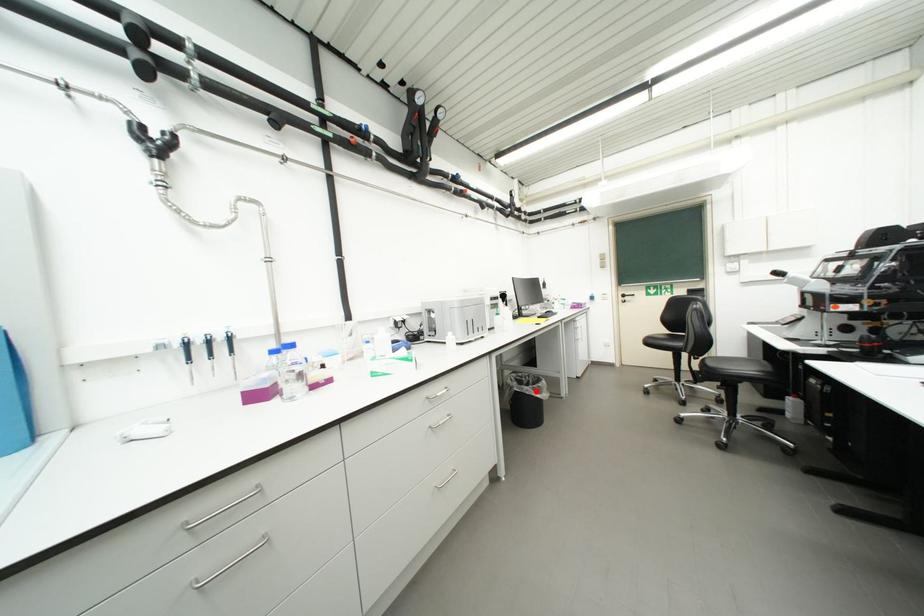
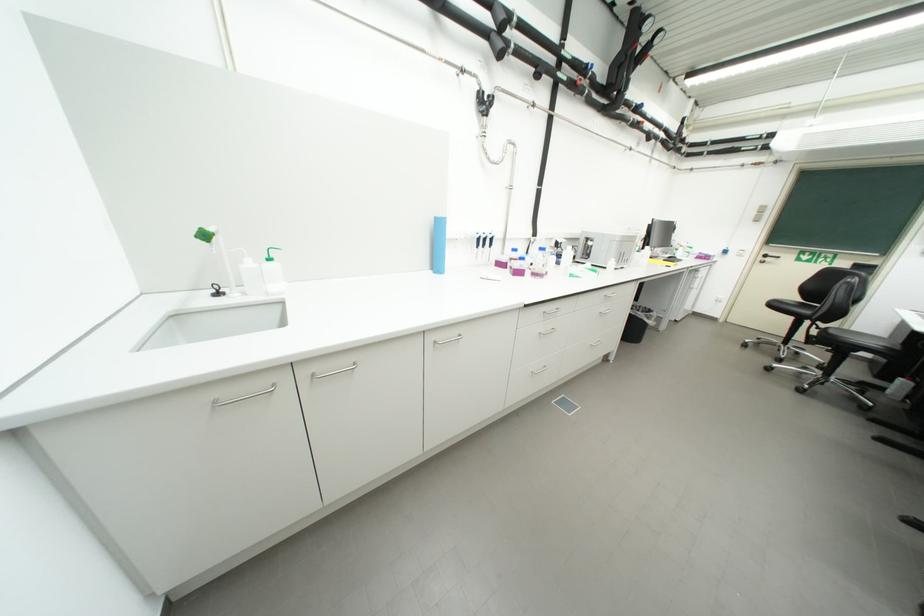
Question: I am providing you with two images of the same scene from different viewpoints. Given a red point in image1, look at the same physical point in image2. Is it:

Choices:
 (A) Closer to the viewpoint
 (B) Farther from the viewpoint

Answer: (B)